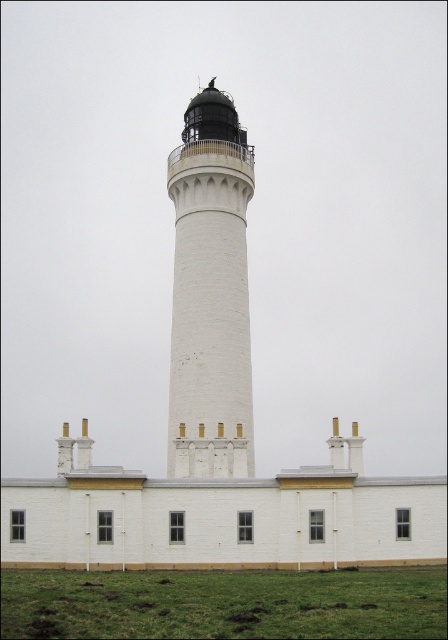
In the scene shown: Can you confirm if green grass at lower center is positioned above white matte/lightweight tower at center?

No, green grass at lower center is not above white matte/lightweight tower at center.

Between green grass at lower center and white matte/lightweight tower at center, which one is positioned higher?

white matte/lightweight tower at center

Who is more forward, [25,570] or [225,120]?

Point [25,570]

Locate an element on the screen. The width and height of the screenshot is (448, 640). green grass at lower center is located at coordinates (224, 604).